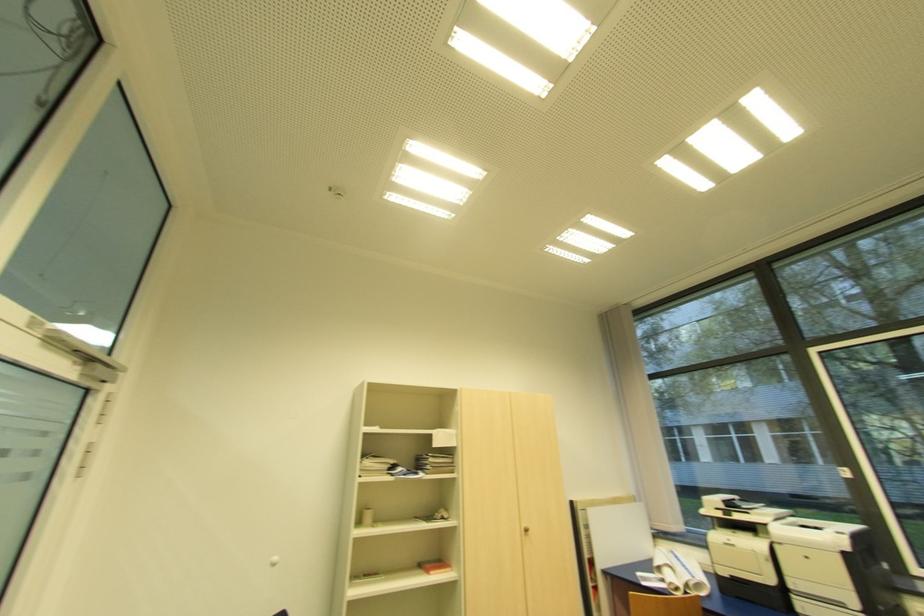
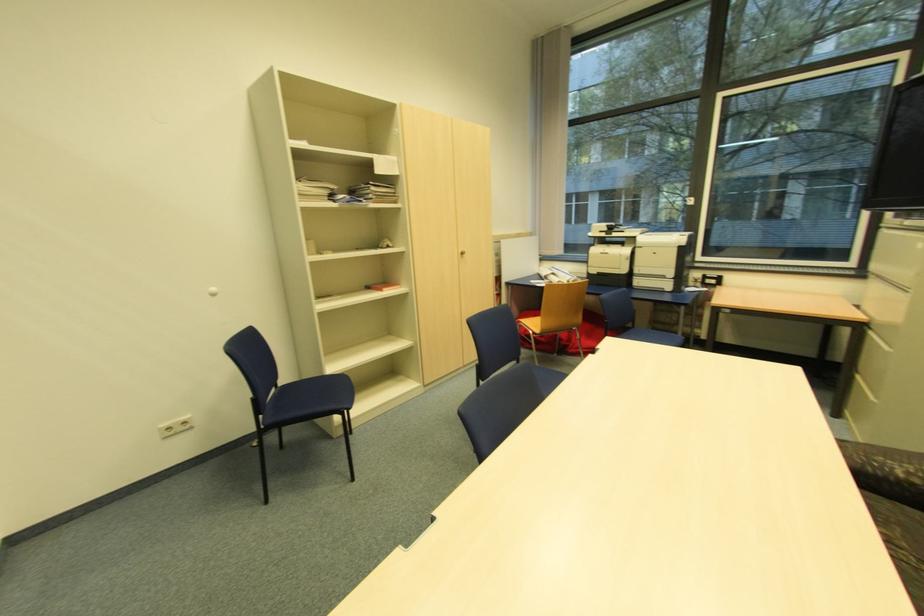
In the second image, find the point that corresponds to (x=529, y=531) in the first image.

(466, 254)